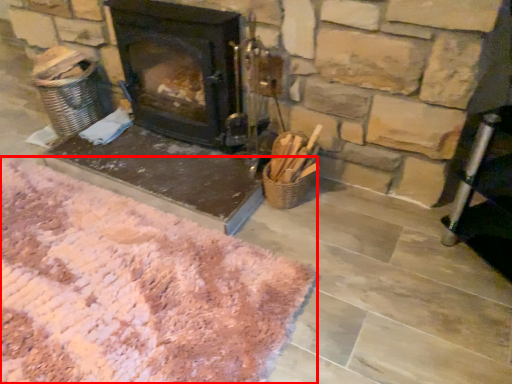
Question: Where is mat (annotated by the red box) located in relation to wood burning stove in the image?

Choices:
 (A) left
 (B) right

Answer: (A)